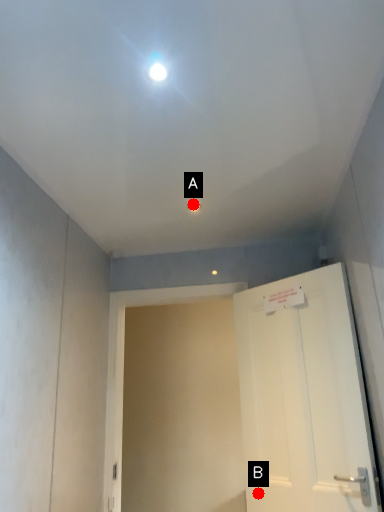
Question: Two points are circled on the image, labeled by A and B beside each circle. Which point appears farthest from the camera in this image?

Choices:
 (A) A is further
 (B) B is further

Answer: (B)